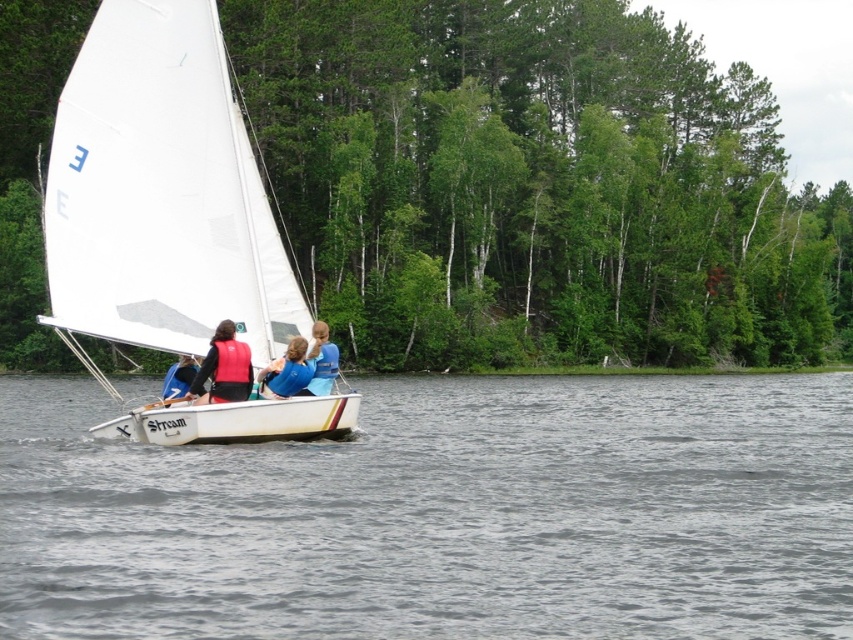
Is point (86, 38) less distant than point (308, 378)?

No, it is not.

Is white sailboat at center bigger than blue padded life vest at center?

Yes, white sailboat at center is bigger than blue padded life vest at center.

Is point (218, 180) behind point (292, 342)?

Yes.

Find the location of a particular element. The width and height of the screenshot is (853, 640). white sailboat at center is located at coordinates (161, 193).

Is gray water at center positioned in front of blue fabric shirt at center?

Yes, it is in front of blue fabric shirt at center.

The image size is (853, 640). What do you see at coordinates (442, 515) in the screenshot?
I see `gray water at center` at bounding box center [442, 515].

Where is `gray water at center`? gray water at center is located at coordinates (442, 515).

Can you confirm if orange life vest at center is positioned to the right of blue padded life vest at center?

Incorrect, orange life vest at center is not on the right side of blue padded life vest at center.

Who is lower down, orange life vest at center or blue padded life vest at center?

blue padded life vest at center is lower down.

What do you see at coordinates (224, 368) in the screenshot?
I see `orange life vest at center` at bounding box center [224, 368].

At what (x,y) coordinates should I click in order to perform the action: click on orange life vest at center. Please return your answer as a coordinate pair (x, y). This screenshot has height=640, width=853. Looking at the image, I should click on (224, 368).